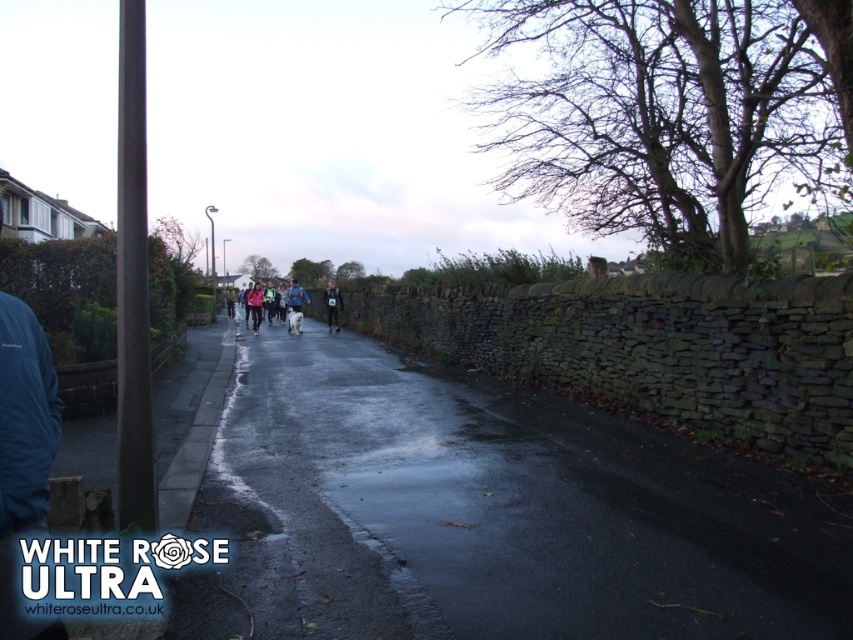
Does dark asphalt pavement at center come in front of blue softshell jacket at lower left?

No, it is not.

Is dark asphalt pavement at center shorter than blue softshell jacket at lower left?

Yes, dark asphalt pavement at center is shorter than blue softshell jacket at lower left.

Who is more forward, (527, 625) or (9, 596)?

Point (9, 596)

At what (x,y) coordinates should I click in order to perform the action: click on dark asphalt pavement at center. Please return your answer as a coordinate pair (x, y). The width and height of the screenshot is (853, 640). Looking at the image, I should click on (489, 513).

Does blue softshell jacket at lower left appear under dark blue running suit at center?

Yes, blue softshell jacket at lower left is below dark blue running suit at center.

Identify the location of blue softshell jacket at lower left. [x=24, y=454].

Consider the image. Who is more forward, [0,314] or [328,314]?

Point [0,314] is in front.

Find the location of a particular element. The height and width of the screenshot is (640, 853). blue softshell jacket at lower left is located at coordinates (24, 454).

Does dark asphalt pavement at center appear under white fabric jacket at center?

Indeed, dark asphalt pavement at center is positioned under white fabric jacket at center.

The height and width of the screenshot is (640, 853). Describe the element at coordinates (489, 513) in the screenshot. I see `dark asphalt pavement at center` at that location.

Describe the element at coordinates (489, 513) in the screenshot. I see `dark asphalt pavement at center` at that location.

Locate an element on the screen. dark asphalt pavement at center is located at coordinates (489, 513).